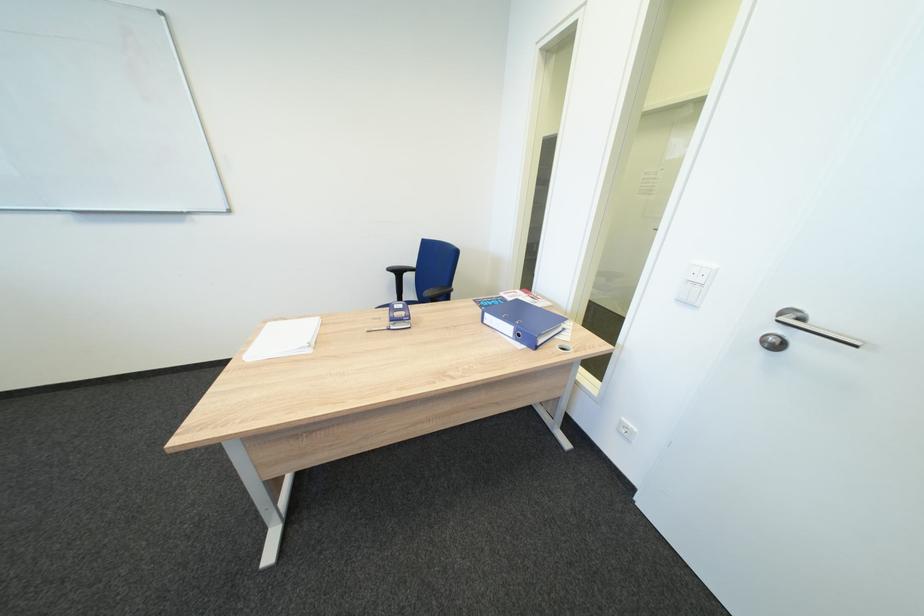
You are a GUI agent. You are given a task and a screenshot of the screen. Output one action in this format:
    pyautogui.click(x=<x>, y=<y>)
    Task: Click on the silver door handle
    
    Given the screenshot: What is the action you would take?
    pyautogui.click(x=800, y=331)